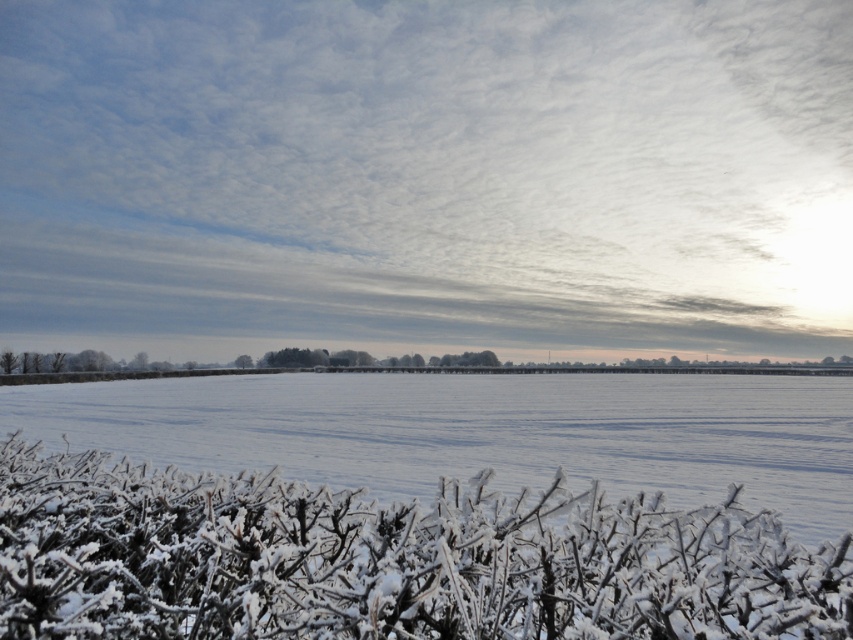
Based on the photo, you are an observer standing in the winter landscape. You notice the white frosty bush at lower center and the white frosty plain at lower center. Which of these two objects is taller?

The white frosty plain at lower center is taller than the white frosty bush at lower center according to the description provided.

You are an artist trying to paint the winter scene. You notice the white frosty bush at lower center and the white frosty plain at lower center. Which one should you paint first if you want to follow the rule of starting with the smaller objects?

The white frosty bush at lower center should be painted first because it has a smaller size compared to the white frosty plain at lower center.